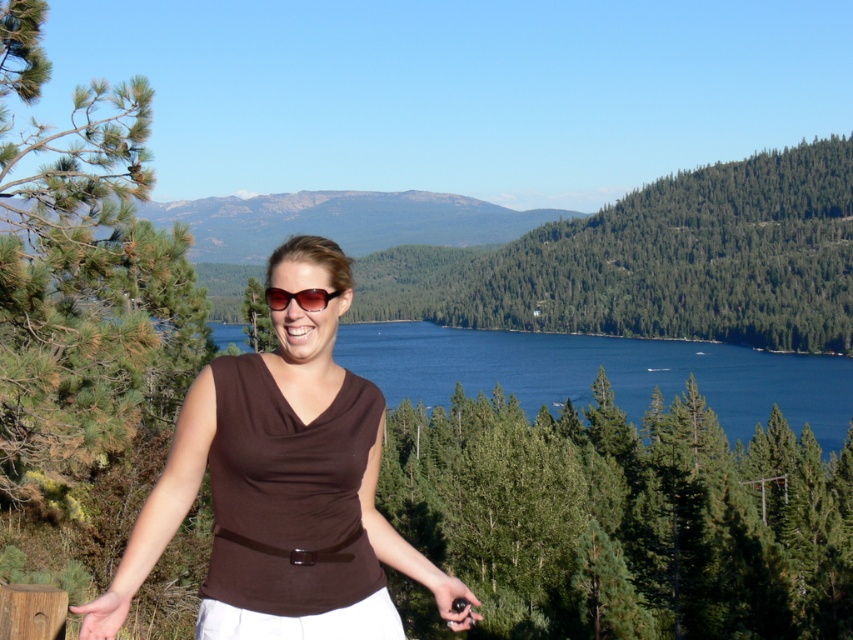
Question: Among these points, which one is farthest from the camera?

Choices:
 (A) (415, 577)
 (B) (300, 300)
 (C) (352, 211)

Answer: (C)

Question: Observing the image, what is the correct spatial positioning of brown fabric shirt at center in reference to rocky gray mountain at upper center?

Choices:
 (A) below
 (B) above

Answer: (A)

Question: Observing the image, what is the correct spatial positioning of brown fabric shirt at center in reference to rocky gray mountain at upper center?

Choices:
 (A) above
 (B) below

Answer: (B)

Question: Is brown fabric shirt at center above brown matte sunglasses at center?

Choices:
 (A) yes
 (B) no

Answer: (B)

Question: Which point appears farthest from the camera in this image?

Choices:
 (A) (270, 301)
 (B) (405, 214)

Answer: (B)

Question: Which object is closer to the camera taking this photo?

Choices:
 (A) rocky gray mountain at upper center
 (B) brown fabric shirt at center
 (C) brown matte sunglasses at center

Answer: (B)